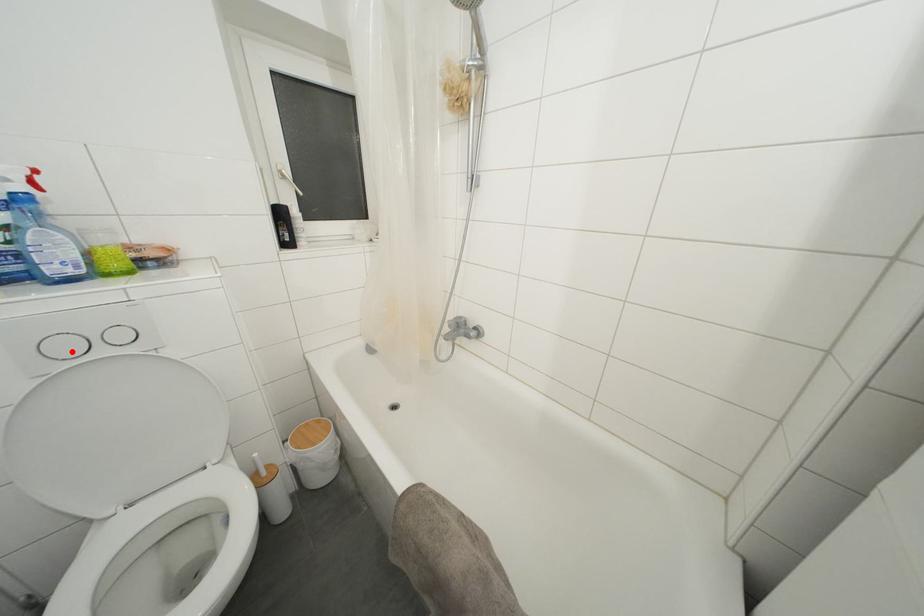
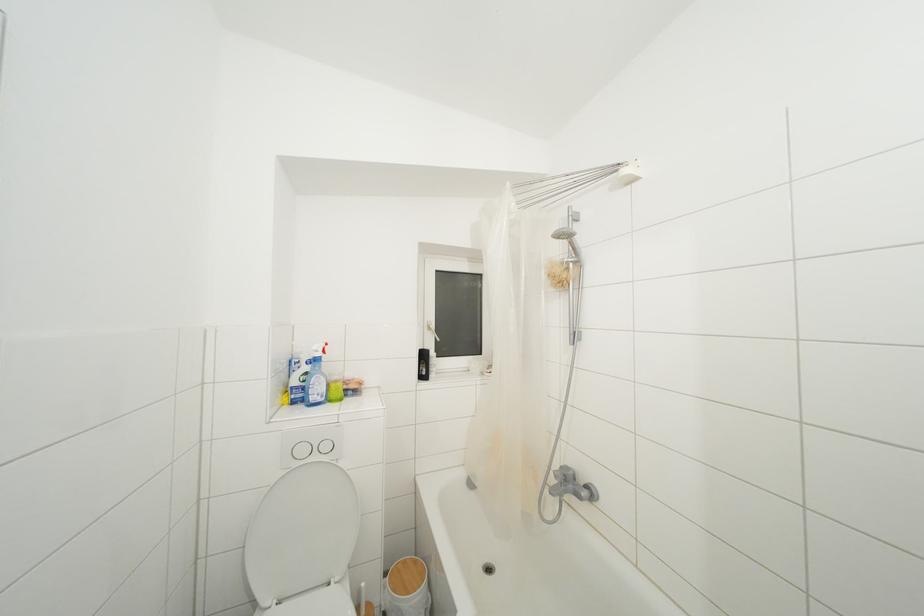
Find the pixel in the second image that matches the highlighted location in the first image.

(307, 456)